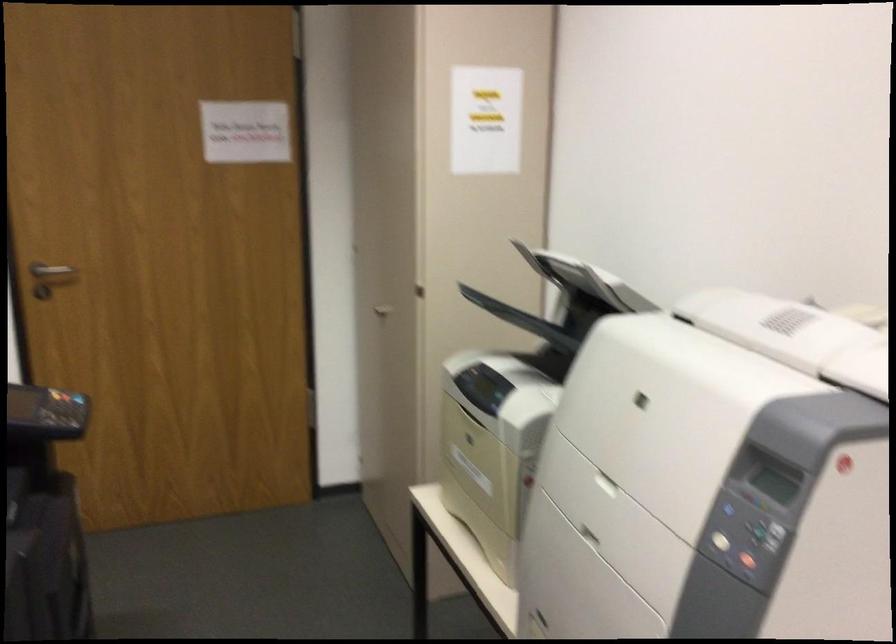
Describe the element at coordinates (382, 307) in the screenshot. I see `a cabinet handle` at that location.